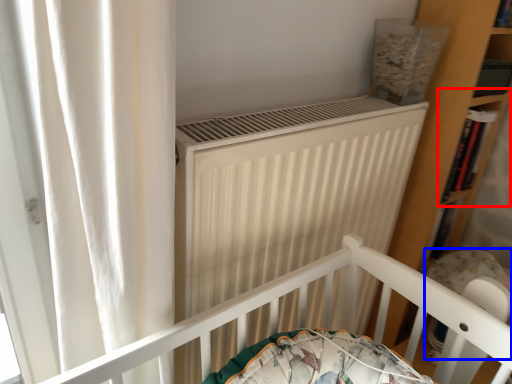
Question: Which of the following is the closest to the observer, shelf (highlighted by a red box) or baby carriage (highlighted by a blue box)?

Choices:
 (A) shelf
 (B) baby carriage

Answer: (B)